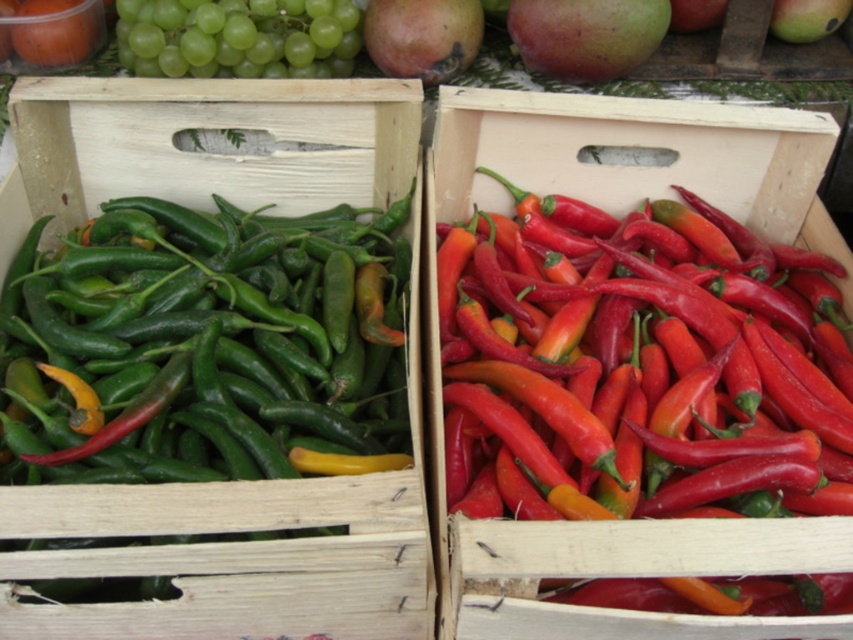
Question: Which point is farther to the camera?

Choices:
 (A) matte wood box at center
 (B) green matte mango at upper right

Answer: (B)

Question: Estimate the real-world distances between objects in this image. Which object is farther from the matte wood box at center?

Choices:
 (A) green matte grapes at upper left
 (B) green matte mango at upper right
 (C) matte green mango at upper center
 (D) green matte chili peppers at left

Answer: (B)

Question: Which object appears closest to the camera in this image?

Choices:
 (A) matte green mango at upper center
 (B) green matte mango at upper right
 (C) green matte grapes at upper left
 (D) matte wood box at center

Answer: (D)

Question: Can you confirm if green matte chili peppers at left is positioned to the right of matte green mango at upper center?

Choices:
 (A) no
 (B) yes

Answer: (A)

Question: Does green matte chili peppers at left appear over green matte mango at upper right?

Choices:
 (A) yes
 (B) no

Answer: (B)

Question: Is green matte grapes at upper left behind matte green mango at upper center?

Choices:
 (A) no
 (B) yes

Answer: (A)